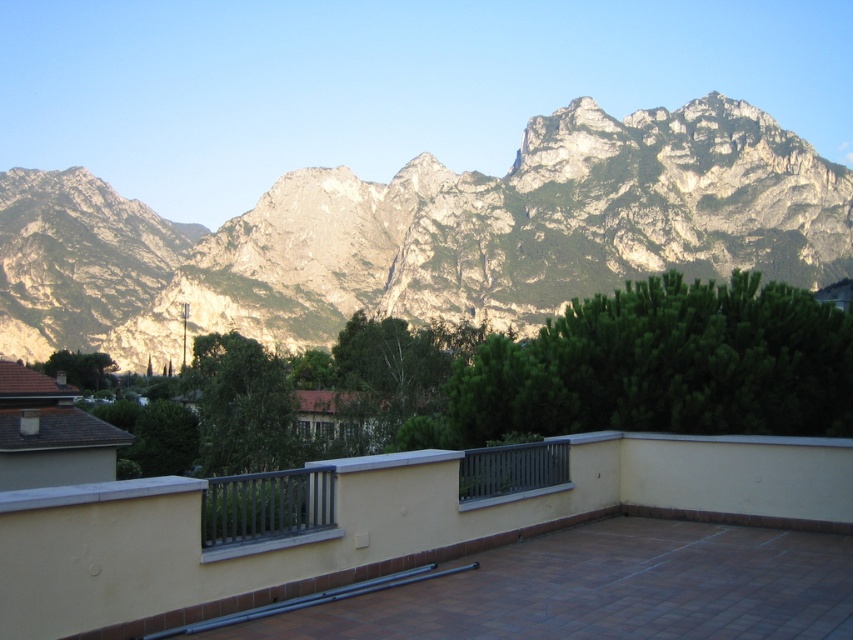
In the scene shown: You are standing at the center of the matte gray balcony at center. If you look directly towards the mountain range, will you see the entire mountain range or just a part of it?

The matte gray balcony at center is located at point (375, 524), so looking directly towards the mountain range from there, you would see the entire mountain range as the balcony is positioned centrally and the mountains are in the background dominating the scene.

You are standing on the balcony at the center of the image. You notice a specific point marked at coordinates (375,524). What object is located at that point?

The point at (375,524) is where the matte gray balcony at center is located.